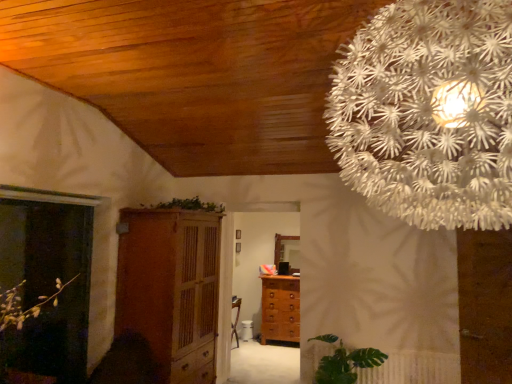
Question: Is translucent glass screen door at left smaller than green leafy plant at upper center?

Choices:
 (A) no
 (B) yes

Answer: (A)

Question: Is translucent glass screen door at left facing away from green leafy plant at upper center?

Choices:
 (A) no
 (B) yes

Answer: (A)

Question: Considering the relative positions of translucent glass screen door at left and green leafy plant at upper center in the image provided, is translucent glass screen door at left in front of green leafy plant at upper center?

Choices:
 (A) no
 (B) yes

Answer: (B)

Question: Does translucent glass screen door at left come behind green leafy plant at upper center?

Choices:
 (A) yes
 (B) no

Answer: (B)

Question: Is translucent glass screen door at left thinner than green leafy plant at upper center?

Choices:
 (A) yes
 (B) no

Answer: (A)

Question: Considering the relative positions of translucent glass screen door at left and green leafy plant at upper center in the image provided, is translucent glass screen door at left to the right of green leafy plant at upper center from the viewer's perspective?

Choices:
 (A) no
 (B) yes

Answer: (A)

Question: Can you confirm if wooden cabinet at center is thinner than green leafy plant at upper center?

Choices:
 (A) no
 (B) yes

Answer: (A)

Question: Is wooden cabinet at center to the left of green leafy plant at upper center from the viewer's perspective?

Choices:
 (A) yes
 (B) no

Answer: (A)

Question: Would you say wooden cabinet at center contains green leafy plant at upper center?

Choices:
 (A) no
 (B) yes

Answer: (A)

Question: Are wooden cabinet at center and green leafy plant at upper center located far from each other?

Choices:
 (A) yes
 (B) no

Answer: (B)

Question: Are wooden cabinet at center and green leafy plant at upper center making contact?

Choices:
 (A) no
 (B) yes

Answer: (A)

Question: From a real-world perspective, is wooden cabinet at center located higher than green leafy plant at upper center?

Choices:
 (A) yes
 (B) no

Answer: (B)

Question: Is translucent glass screen door at left turned away from wooden cabinet at center?

Choices:
 (A) yes
 (B) no

Answer: (B)